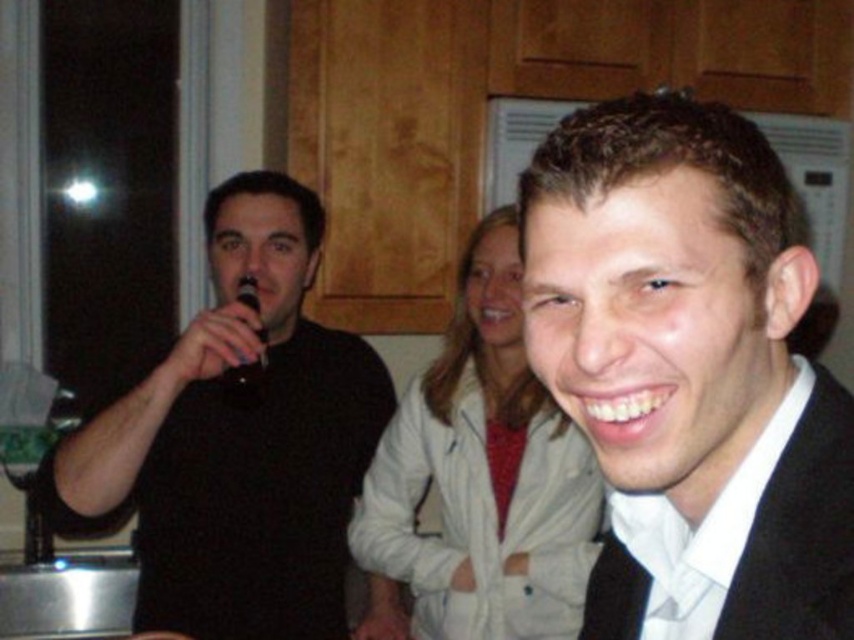
Find the location of `black matte suit at center`. black matte suit at center is located at coordinates (662, 289).

Who is more distant from viewer, [825,532] or [237,392]?

Point [237,392]

Identify the location of black matte suit at center. This screenshot has width=854, height=640. (662, 289).

Does point (258, 500) come in front of point (256, 392)?

No, it is not.

Between black matte microphone at left and black plastic microphone at left, which one appears on the left side from the viewer's perspective?

black plastic microphone at left

Image resolution: width=854 pixels, height=640 pixels. Find the location of `black matte microphone at left`. black matte microphone at left is located at coordinates point(237,442).

Between black matte suit at center and black matte microphone at left, which one has less height?

black matte suit at center

Is black matte suit at center taller than black matte microphone at left?

Incorrect, black matte suit at center's height is not larger of black matte microphone at left's.

Identify the location of black matte suit at center. The width and height of the screenshot is (854, 640). (662, 289).